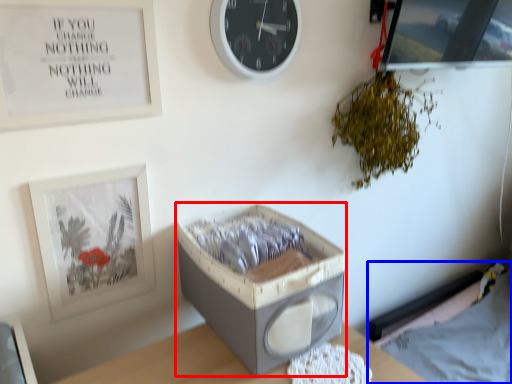
Question: Which object is further to the camera taking this photo, storage box (highlighted by a red box) or hospital bed (highlighted by a blue box)?

Choices:
 (A) storage box
 (B) hospital bed

Answer: (B)